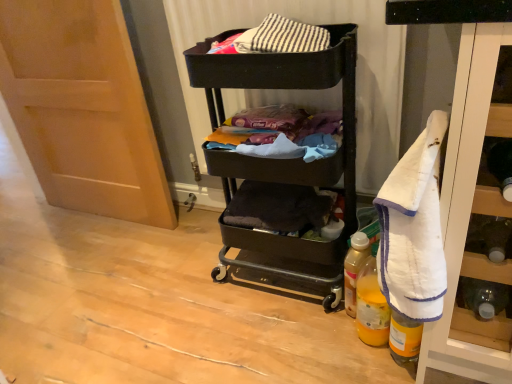
What do you see at coordinates (404, 338) in the screenshot? I see `yellow plastic bottle at lower right, arranged as the third bottle when viewed from the back` at bounding box center [404, 338].

At what (x,y) coordinates should I click in order to perform the action: click on translucent yellow plastic bottle at lower right, which is the 2th bottle in front-to-back order. Please return your answer as a coordinate pair (x, y). This screenshot has height=384, width=512. Looking at the image, I should click on (371, 307).

Locate an element on the screen. The width and height of the screenshot is (512, 384). black matte cart at center is located at coordinates (282, 88).

Image resolution: width=512 pixels, height=384 pixels. What do you see at coordinates (282, 88) in the screenshot? I see `black matte cart at center` at bounding box center [282, 88].

Image resolution: width=512 pixels, height=384 pixels. What do you see at coordinates (280, 133) in the screenshot?
I see `matte fabric laundry at center` at bounding box center [280, 133].

What are the coordinates of `matte wood door at left` in the screenshot? It's located at pos(82,108).

Is translucent yellow plastic bottle at lower right, which is the 2th bottle in front-to-back order, surrounded by black matte cart at center?

Definitely not — translucent yellow plastic bottle at lower right, which is the 2th bottle in front-to-back order, is not inside black matte cart at center.

Can you confirm if black matte cart at center is shorter than translucent yellow plastic bottle at lower right, the second bottle when ordered from back to front?

No, black matte cart at center is not shorter than translucent yellow plastic bottle at lower right, the second bottle when ordered from back to front.

From the image's perspective, between black matte cart at center and translucent yellow plastic bottle at lower right, the second bottle when ordered from back to front, who is located below?

translucent yellow plastic bottle at lower right, the second bottle when ordered from back to front.

Based on their sizes in the image, would you say black matte cart at center is bigger or smaller than translucent yellow plastic bottle at lower right, the second bottle when ordered from back to front?

In the image, black matte cart at center appears to be larger than translucent yellow plastic bottle at lower right, the second bottle when ordered from back to front.

From a real-world perspective, is translucent yellow plastic bottle at lower right, which is the 2th bottle in front-to-back order, beneath white terry cloth towel at right?

Indeed, from a real-world perspective, translucent yellow plastic bottle at lower right, which is the 2th bottle in front-to-back order, is positioned beneath white terry cloth towel at right.

From the image's perspective, is translucent yellow plastic bottle at lower right, the second bottle when ordered from back to front, over white terry cloth towel at right?

Actually, translucent yellow plastic bottle at lower right, the second bottle when ordered from back to front, appears below white terry cloth towel at right in the image.

Is there a large distance between translucent yellow plastic bottle at lower right, the second bottle when ordered from back to front, and white terry cloth towel at right?

translucent yellow plastic bottle at lower right, the second bottle when ordered from back to front, is near white terry cloth towel at right, not far away.

Is the position of black matte cart at center more distant than that of matte wood door at left?

No, black matte cart at center is closer to the camera.

From the image's perspective, relative to matte wood door at left, is black matte cart at center above or below?

black matte cart at center is situated lower than matte wood door at left in the image.

Based on their positions, is black matte cart at center located to the left or right of matte wood door at left?

black matte cart at center is to the right of matte wood door at left.

In terms of height, does translucent plastic bottle at lower right, which appears as the first bottle when viewed from the back, look taller or shorter compared to white terry cloth towel at right?

Clearly, translucent plastic bottle at lower right, which appears as the first bottle when viewed from the back, is shorter compared to white terry cloth towel at right.

From a real-world perspective, is translucent plastic bottle at lower right, which appears as the first bottle when viewed from the back, physically below white terry cloth towel at right?

Correct, in the physical world, translucent plastic bottle at lower right, which appears as the first bottle when viewed from the back, is lower than white terry cloth towel at right.

Is translucent plastic bottle at lower right, which appears as the first bottle when viewed from the back, smaller than white terry cloth towel at right?

Indeed, translucent plastic bottle at lower right, which appears as the first bottle when viewed from the back, has a smaller size compared to white terry cloth towel at right.

Is translucent plastic bottle at lower right, which appears as the first bottle when viewed from the back, thinner than white terry cloth towel at right?

Indeed, translucent plastic bottle at lower right, which appears as the first bottle when viewed from the back, has a lesser width compared to white terry cloth towel at right.

From the image's perspective, is matte fabric laundry at center above or below translucent yellow plastic bottle at lower right, the second bottle when ordered from back to front?

matte fabric laundry at center is above translucent yellow plastic bottle at lower right, the second bottle when ordered from back to front.

Is matte fabric laundry at center closer to the viewer compared to translucent yellow plastic bottle at lower right, the second bottle when ordered from back to front?

That is False.

Does matte fabric laundry at center touch translucent yellow plastic bottle at lower right, which is the 2th bottle in front-to-back order?

No.

This screenshot has width=512, height=384. I want to click on laundry on the left of translucent yellow plastic bottle at lower right, the second bottle when ordered from back to front, so click(280, 133).

From the image's perspective, is matte wood door at left over white terry cloth towel at right?

Yes, from the image's perspective, matte wood door at left is over white terry cloth towel at right.

Between point (49, 73) and point (421, 159), which one is positioned in front?

The point (421, 159) is closer to the camera.

Does matte wood door at left contain white terry cloth towel at right?

No, white terry cloth towel at right is not surrounded by matte wood door at left.

The width and height of the screenshot is (512, 384). I want to click on bath towel in front of the matte wood door at left, so click(414, 228).

Can you confirm if translucent yellow plastic bottle at lower right, which is the 2th bottle in front-to-back order, is positioned to the right of yellow plastic bottle at lower right, arranged as the third bottle when viewed from the back?

Incorrect, translucent yellow plastic bottle at lower right, which is the 2th bottle in front-to-back order, is not on the right side of yellow plastic bottle at lower right, arranged as the third bottle when viewed from the back.

Considering the positions of objects translucent yellow plastic bottle at lower right, which is the 2th bottle in front-to-back order, and yellow plastic bottle at lower right, arranged as the third bottle when viewed from the back, in the image provided, who is behind, translucent yellow plastic bottle at lower right, which is the 2th bottle in front-to-back order, or yellow plastic bottle at lower right, arranged as the third bottle when viewed from the back,?

translucent yellow plastic bottle at lower right, which is the 2th bottle in front-to-back order.

How distant is translucent yellow plastic bottle at lower right, which is the 2th bottle in front-to-back order, from yellow plastic bottle at lower right, marked as the 1th bottle in a front-to-back arrangement?

translucent yellow plastic bottle at lower right, which is the 2th bottle in front-to-back order, and yellow plastic bottle at lower right, marked as the 1th bottle in a front-to-back arrangement, are 2.91 inches apart.

Is translucent yellow plastic bottle at lower right, which is the 2th bottle in front-to-back order, beside yellow plastic bottle at lower right, marked as the 1th bottle in a front-to-back arrangement?

Yes, translucent yellow plastic bottle at lower right, which is the 2th bottle in front-to-back order, is touching yellow plastic bottle at lower right, marked as the 1th bottle in a front-to-back arrangement.

From the black matte cart at center, count 2nd bottle to the right and point to it. Please provide its 2D coordinates.

[(371, 307)]

Locate an element on the screen. bath towel in front of the translucent yellow plastic bottle at lower right, the second bottle when ordered from back to front is located at coordinates (414, 228).

Estimate the real-world distances between objects in this image. Which object is further from yellow plastic bottle at lower right, arranged as the third bottle when viewed from the back, translucent yellow plastic bottle at lower right, the second bottle when ordered from back to front, or white terry cloth towel at right?

white terry cloth towel at right is positioned further to the anchor yellow plastic bottle at lower right, arranged as the third bottle when viewed from the back.

Which object lies further to the anchor point yellow plastic bottle at lower right, marked as the 1th bottle in a front-to-back arrangement, white terry cloth towel at right or translucent yellow plastic bottle at lower right, which is the 2th bottle in front-to-back order?

white terry cloth towel at right is further to yellow plastic bottle at lower right, marked as the 1th bottle in a front-to-back arrangement.

Which object lies further to the anchor point matte fabric laundry at center, yellow plastic bottle at lower right, marked as the 1th bottle in a front-to-back arrangement, or translucent yellow plastic bottle at lower right, which is the 2th bottle in front-to-back order?

Among the two, yellow plastic bottle at lower right, marked as the 1th bottle in a front-to-back arrangement, is located further to matte fabric laundry at center.

Which object lies nearer to the anchor point translucent yellow plastic bottle at lower right, the second bottle when ordered from back to front, white terry cloth towel at right or yellow plastic bottle at lower right, marked as the 1th bottle in a front-to-back arrangement?

yellow plastic bottle at lower right, marked as the 1th bottle in a front-to-back arrangement.

Which object lies further to the anchor point yellow plastic bottle at lower right, marked as the 1th bottle in a front-to-back arrangement, white terry cloth towel at right or translucent plastic bottle at lower right, which appears as the first bottle when viewed from the back?

white terry cloth towel at right.

Based on their spatial positions, is yellow plastic bottle at lower right, arranged as the third bottle when viewed from the back, or translucent yellow plastic bottle at lower right, which is the 2th bottle in front-to-back order, closer to white terry cloth towel at right?

The object closer to white terry cloth towel at right is yellow plastic bottle at lower right, arranged as the third bottle when viewed from the back.

From the picture: Estimate the real-world distances between objects in this image. Which object is further from matte fabric laundry at center, matte wood door at left or translucent yellow plastic bottle at lower right, the second bottle when ordered from back to front?

Based on the image, matte wood door at left appears to be further to matte fabric laundry at center.

Looking at the image, which one is located closer to yellow plastic bottle at lower right, arranged as the third bottle when viewed from the back, matte fabric laundry at center or matte wood door at left?

matte fabric laundry at center is closer to yellow plastic bottle at lower right, arranged as the third bottle when viewed from the back.

The image size is (512, 384). In order to click on shelf between matte fabric laundry at center and yellow plastic bottle at lower right, arranged as the third bottle when viewed from the back, in the up-down direction in this screenshot , I will do `click(282, 88)`.

You are a GUI agent. You are given a task and a screenshot of the screen. Output one action in this format:
    pyautogui.click(x=<x>, y=<y>)
    Task: Click on the shelf between white terry cloth towel at right and translucent yellow plastic bottle at lower right, the second bottle when ordered from back to front, in the front-back direction
    
    Given the screenshot: What is the action you would take?
    pyautogui.click(x=282, y=88)

Identify the location of laundry between matte wood door at left and translucent yellow plastic bottle at lower right, the second bottle when ordered from back to front, from left to right. (280, 133).

You are a GUI agent. You are given a task and a screenshot of the screen. Output one action in this format:
    pyautogui.click(x=<x>, y=<y>)
    Task: Click on the laundry between white terry cloth towel at right and translucent plastic bottle at lower right, positioned as the 3th bottle in front-to-back order, along the z-axis
    
    Given the screenshot: What is the action you would take?
    click(280, 133)